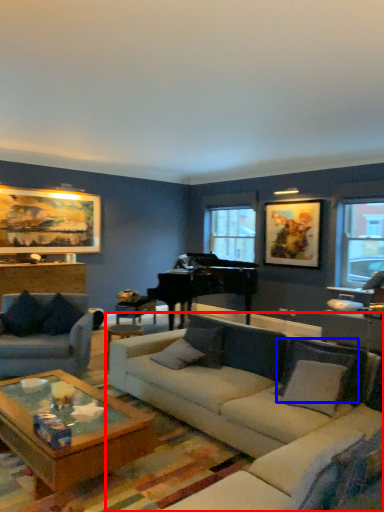
Question: Which object is closer to the camera taking this photo, studio couch (highlighted by a red box) or pillow (highlighted by a blue box)?

Choices:
 (A) studio couch
 (B) pillow

Answer: (A)